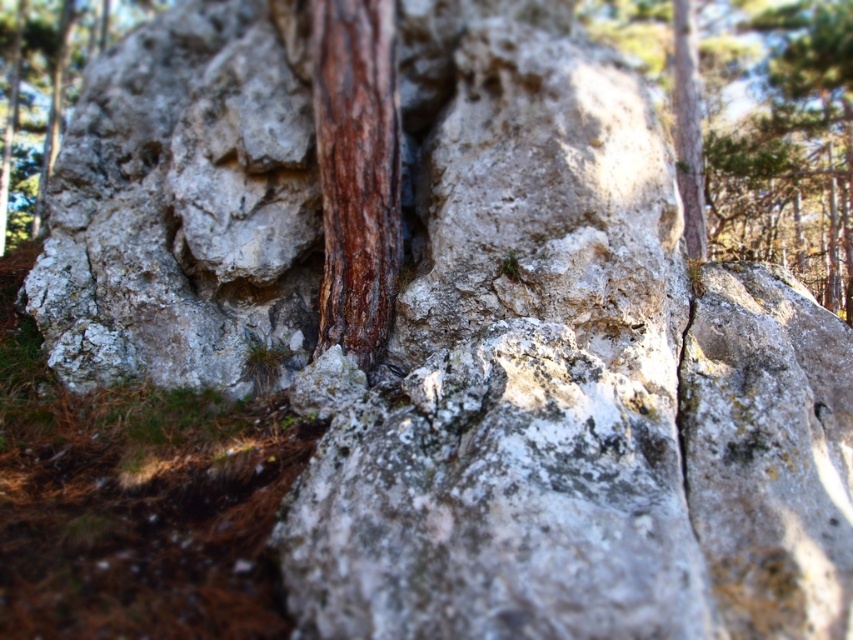
Which is above, brown rough bark at upper right or brown rough tree trunk at center?

Positioned higher is brown rough bark at upper right.

Between brown rough bark at upper right and brown rough tree trunk at center, which one appears on the left side from the viewer's perspective?

brown rough tree trunk at center

Where is `brown rough bark at upper right`? The image size is (853, 640). brown rough bark at upper right is located at coordinates (755, 124).

Identify the location of brown rough bark at upper right. Image resolution: width=853 pixels, height=640 pixels. pos(755,124).

Is brown rough tree trunk at center smaller than smooth brown tree trunk at left?

Yes.

Which is above, brown rough tree trunk at center or smooth brown tree trunk at left?

smooth brown tree trunk at left

Which is in front, point (380, 237) or point (9, 230)?

Point (380, 237)

Locate an element on the screen. The image size is (853, 640). brown rough tree trunk at center is located at coordinates (357, 172).

Image resolution: width=853 pixels, height=640 pixels. What do you see at coordinates (755, 124) in the screenshot?
I see `brown rough bark at upper right` at bounding box center [755, 124].

Which of these two, brown rough bark at upper right or smooth brown tree trunk at left, stands taller?

smooth brown tree trunk at left is taller.

You are a GUI agent. You are given a task and a screenshot of the screen. Output one action in this format:
    pyautogui.click(x=<x>, y=<y>)
    Task: Click on the brown rough bark at upper right
    Image resolution: width=853 pixels, height=640 pixels.
    Given the screenshot: What is the action you would take?
    pyautogui.click(x=755, y=124)

The width and height of the screenshot is (853, 640). Find the location of `brown rough bark at upper right`. brown rough bark at upper right is located at coordinates (755, 124).